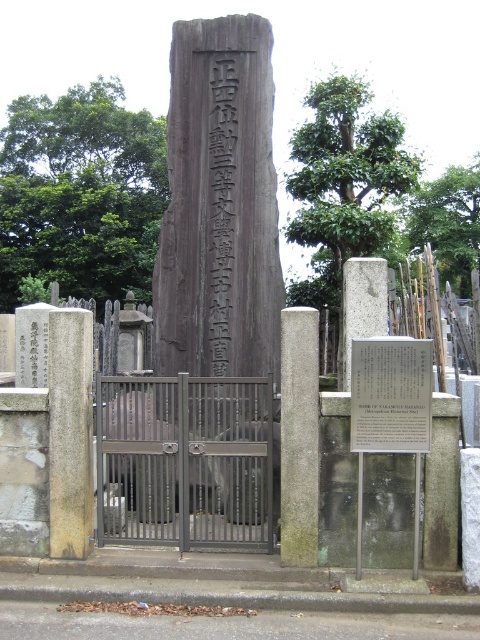
Question: Which is farther from the gray concrete pillar at center?

Choices:
 (A) metallic plaque at center
 (B) gray stone marker at center
 (C) dark brown wood at center
 (D) gray stone pillar at left

Answer: (C)

Question: From the image, what is the correct spatial relationship of gray stone pillar at left in relation to metallic plaque at center?

Choices:
 (A) above
 (B) below

Answer: (B)

Question: Is dark brown wood at center below gray stone marker at center?

Choices:
 (A) yes
 (B) no

Answer: (B)

Question: Which point is farther to the camera?

Choices:
 (A) metallic gate at center
 (B) metallic plaque at center

Answer: (A)

Question: Which is farther from the gray stone marker at center?

Choices:
 (A) metallic plaque at center
 (B) dark brown wood at center
 (C) metallic gate at center
 (D) gray concrete pillar at center

Answer: (C)

Question: Does metallic plaque at center come behind gray stone marker at center?

Choices:
 (A) yes
 (B) no

Answer: (B)